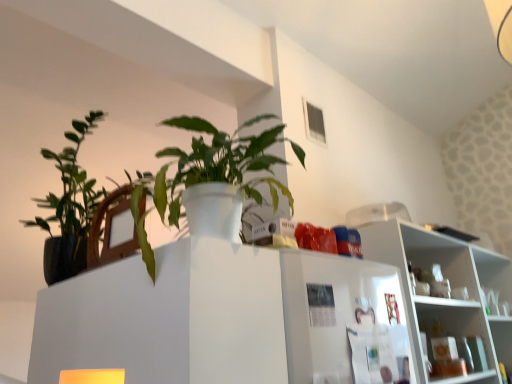
Question: In terms of height, does white glossy shelf at upper right look taller or shorter compared to green matte plant at upper left?

Choices:
 (A) tall
 (B) short

Answer: (A)

Question: From the image's perspective, relative to green matte plant at upper left, is white glossy shelf at upper right above or below?

Choices:
 (A) below
 (B) above

Answer: (A)

Question: From a real-world perspective, is white glossy shelf at upper right positioned above or below green matte plant at upper left?

Choices:
 (A) above
 (B) below

Answer: (B)

Question: From the image's perspective, relative to white glossy shelf at upper right, is green matte plant at upper left above or below?

Choices:
 (A) below
 (B) above

Answer: (B)

Question: Is green matte plant at upper left wider or thinner than white glossy shelf at upper right?

Choices:
 (A) thin
 (B) wide

Answer: (B)

Question: From a real-world perspective, relative to white glossy shelf at upper right, is green matte plant at upper left vertically above or below?

Choices:
 (A) above
 (B) below

Answer: (A)

Question: Relative to white glossy shelf at upper right, is green matte plant at upper left in front or behind?

Choices:
 (A) behind
 (B) front

Answer: (B)